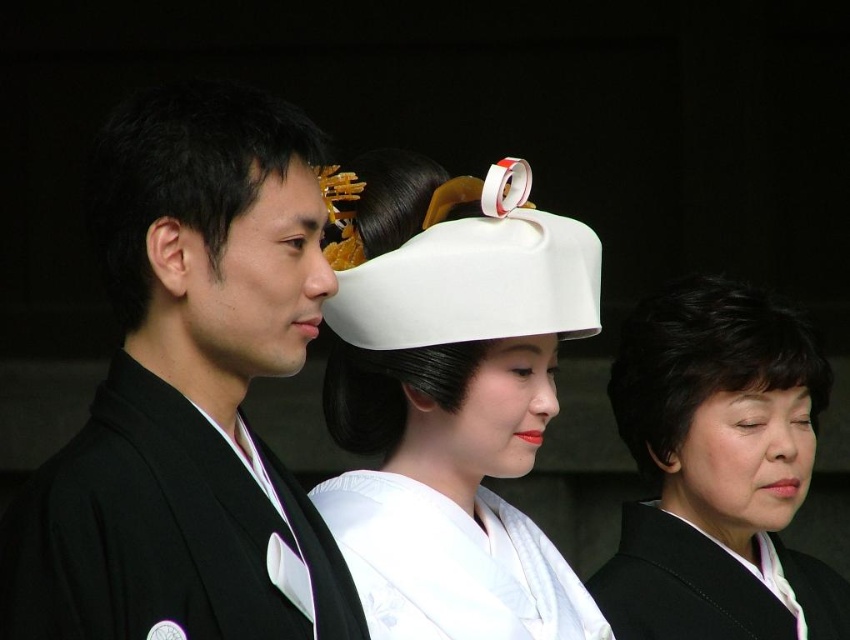
Based on the scene description, where is the white silk kimono at center located in terms of its 2D coordinates?

The white silk kimono at center is located at the 2D coordinates point (451, 564).

You are a photographer observing the scene. You need to capture a photo where both the black matte hair at center and the black matte hair at left are visible. Which hair should you adjust your camera angle to ensure it fits better in the frame?

The black matte hair at center has a greater width compared to the black matte hair at left, so adjusting the camera angle to accommodate the wider black matte hair at center would ensure both fit better in the frame.